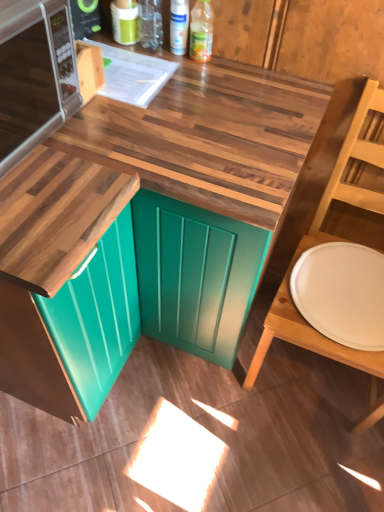
Identify the location of vacant space in front of white glossy spray can at upper center, positioned as the second bottle in right-to-left order. (169, 78).